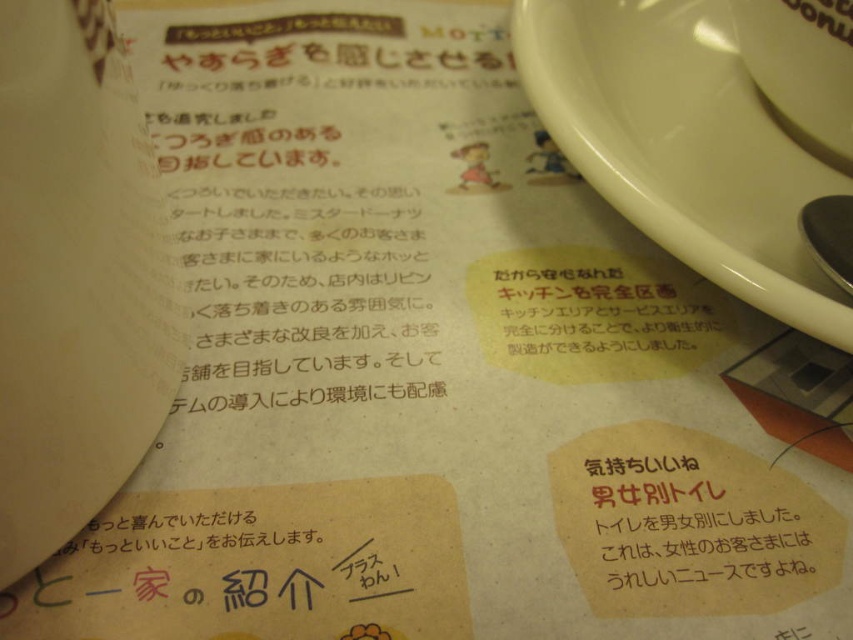
You are trying to determine if the white glossy saucer at upper right can fit over the shiny metallic spoon at right. Based on their sizes, is this possible?

The white glossy saucer at upper right is taller than the shiny metallic spoon at right, so it can fit over the spoon.

You are trying to read the menu but notice two items on the document. Which one is closer to the left edge of the document between the white glossy saucer at upper right and the white glossy coffee cup at upper right?

The white glossy saucer at upper right is to the left of the white glossy coffee cup at upper right, so the saucer is closer to the left edge of the document.

You are organizing a small table for a tea ceremony and need to place the white glossy saucer at upper right and the shiny metallic spoon at right. Since the saucer is larger, where should you position them to ensure stability?

The white glossy saucer at upper right should be placed underneath the shiny metallic spoon at right because it is larger and can provide a stable base for the spoon.